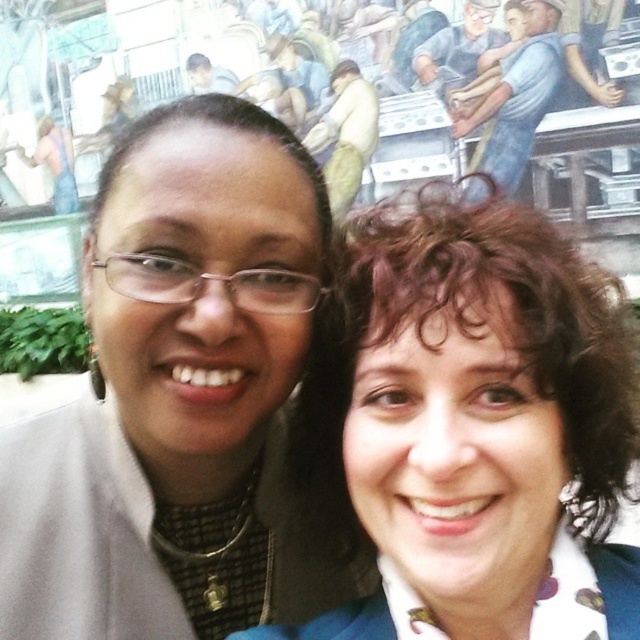
Is matte black jacket at left in front of blue fabric shirt at upper right?

Yes.

Who is more distant from viewer, (166, 118) or (536, 86)?

Positioned behind is point (536, 86).

I want to click on matte black jacket at left, so click(x=179, y=396).

Who is positioned more to the right, matte black jacket at left or curly brown hair at center?

From the viewer's perspective, curly brown hair at center appears more on the right side.

From the picture: Can you confirm if matte black jacket at left is shorter than curly brown hair at center?

Yes, matte black jacket at left is shorter than curly brown hair at center.

The height and width of the screenshot is (640, 640). What do you see at coordinates (179, 396) in the screenshot?
I see `matte black jacket at left` at bounding box center [179, 396].

Locate an element on the screen. matte black jacket at left is located at coordinates (179, 396).

Is curly brown hair at center wider than blue fabric shirt at upper right?

Indeed, curly brown hair at center has a greater width compared to blue fabric shirt at upper right.

Is point (627, 605) positioned before point (483, 144)?

Yes, it is.

Is point (502, 276) positioned behind point (532, 45)?

No, (502, 276) is in front of (532, 45).

Find the location of `curly brown hair at center`. curly brown hair at center is located at coordinates (480, 428).